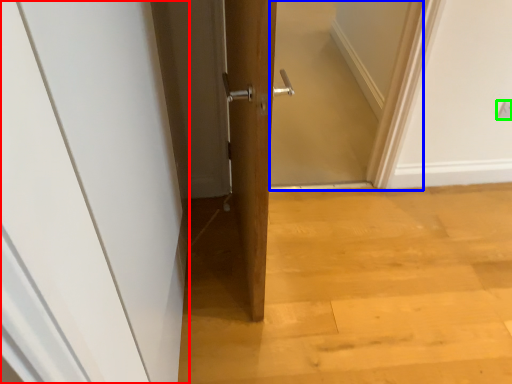
Question: Estimate the real-world distances between objects in this image. Which object is farther from door (highlighted by a red box), screen door (highlighted by a blue box) or electric outlet (highlighted by a green box)?

Choices:
 (A) screen door
 (B) electric outlet

Answer: (B)